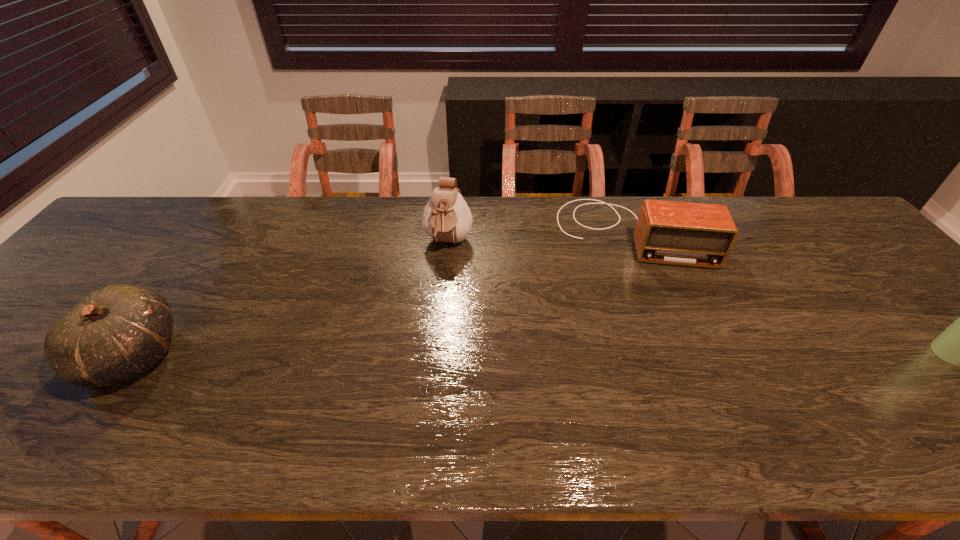
Identify the location of free space on the desktop that is between the leftmost object and the thermos bottle and is positioned on the front-facing side of the second object from left to right. The height and width of the screenshot is (540, 960). (424, 355).

Where is `free space on the desktop that is between the leftmost object and the tallest object and is positioned on the front-facing side of the shortest object`? free space on the desktop that is between the leftmost object and the tallest object and is positioned on the front-facing side of the shortest object is located at coordinates (654, 354).